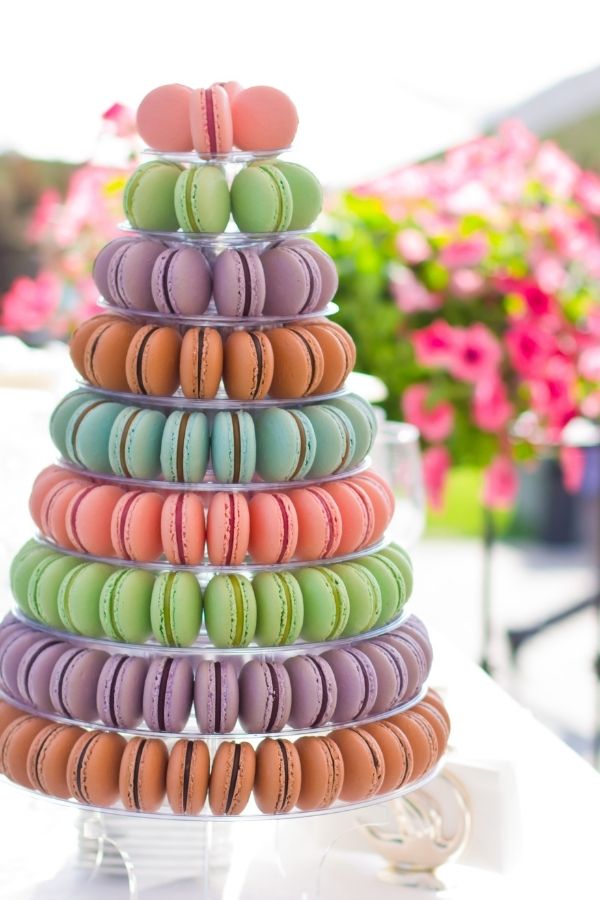
Find the location of a particular element. Image resolution: width=600 pixels, height=900 pixels. napkin holder is located at coordinates click(442, 849).